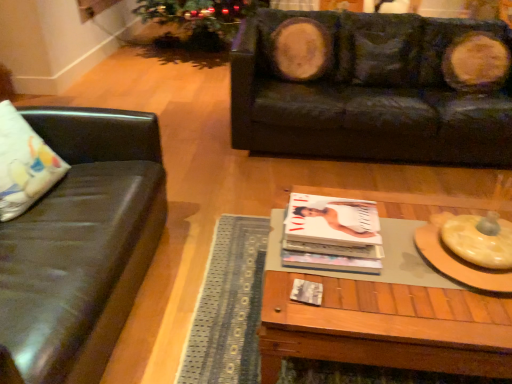
Where is `vacant space in front of matte white magazine at center`? The image size is (512, 384). vacant space in front of matte white magazine at center is located at coordinates (353, 303).